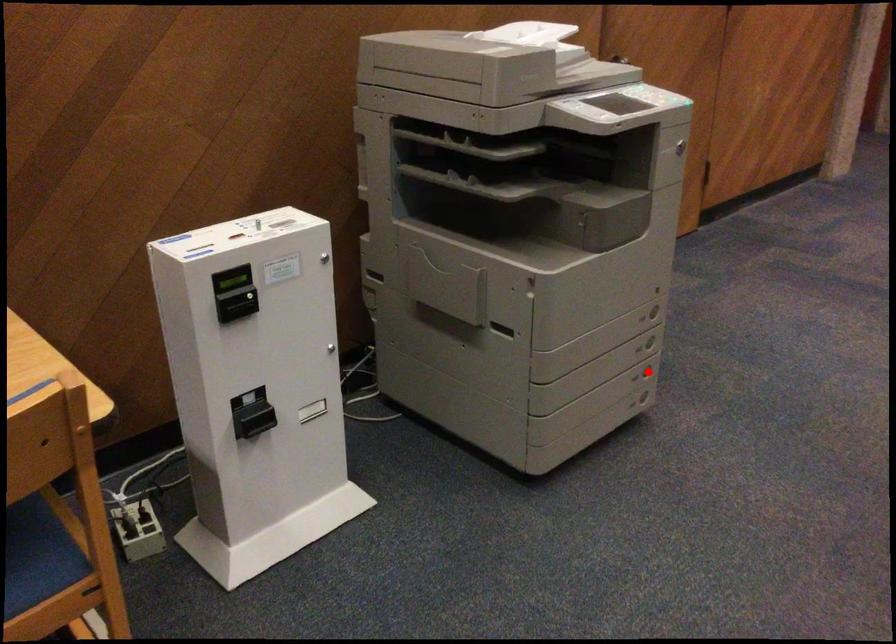
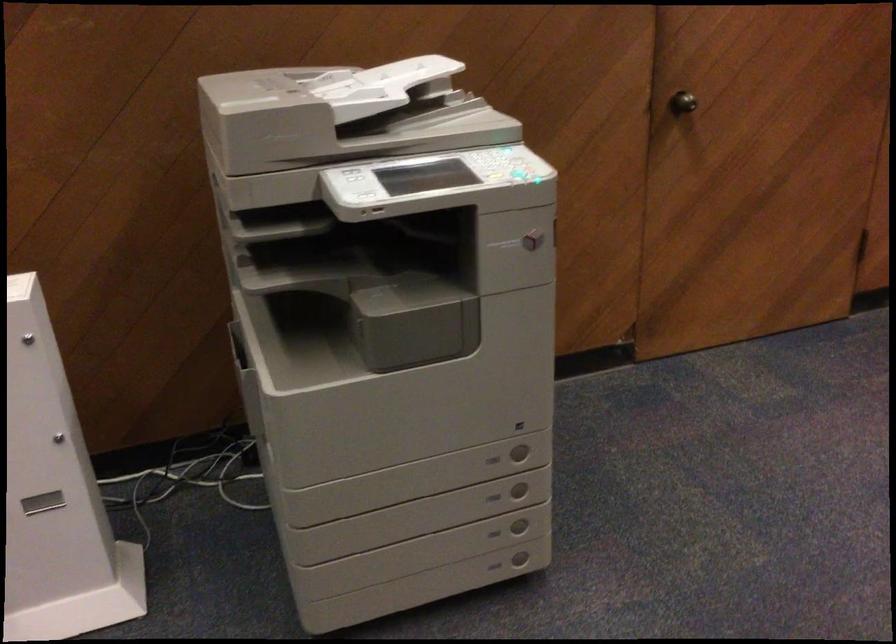
Question: A red point is marked in image1. In image2, is the corresponding 3D point closer to the camera or farther? Reply with the corresponding letter.

Choices:
 (A) The corresponding 3D point is closer.
 (B) The corresponding 3D point is farther.

Answer: (A)